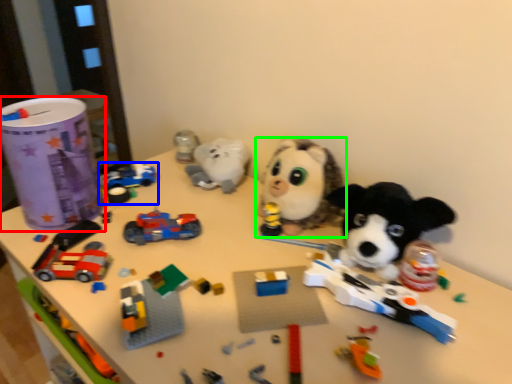
Question: Which is farther away from toy (highlighted by a red box)? toy (highlighted by a blue box) or toy (highlighted by a green box)?

Choices:
 (A) toy
 (B) toy

Answer: (B)